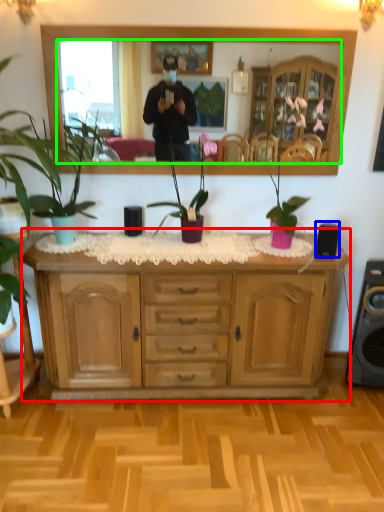
Question: Based on their relative distances, which object is nearer to cabinetry (highlighted by a red box)? Choose from speaker (highlighted by a blue box) and mirror (highlighted by a green box).

Choices:
 (A) speaker
 (B) mirror

Answer: (A)